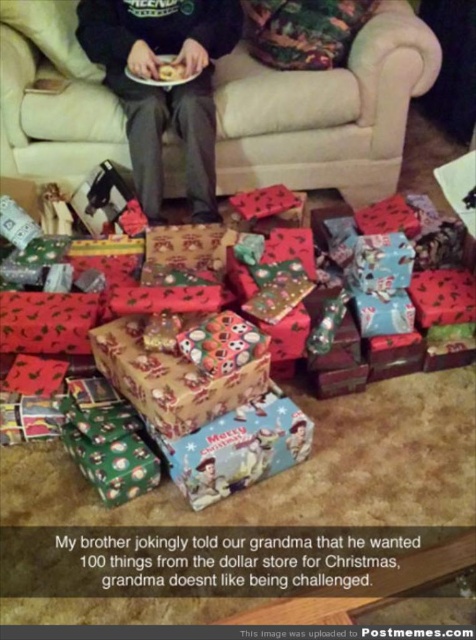
Question: Can you confirm if beige fabric couch at upper center is thinner than black matte pants at center?

Choices:
 (A) no
 (B) yes

Answer: (A)

Question: Can you confirm if beige fabric couch at upper center is smaller than black matte pants at center?

Choices:
 (A) yes
 (B) no

Answer: (B)

Question: Which object is farther from the camera taking this photo?

Choices:
 (A) black matte pants at center
 (B) beige fabric couch at upper center

Answer: (B)

Question: Which object is farther from the camera taking this photo?

Choices:
 (A) beige fabric couch at upper center
 (B) black matte pants at center

Answer: (A)

Question: Which point is closer to the camera?

Choices:
 (A) (78, 150)
 (B) (116, 84)

Answer: (B)

Question: Can you confirm if beige fabric couch at upper center is bigger than black matte pants at center?

Choices:
 (A) no
 (B) yes

Answer: (B)